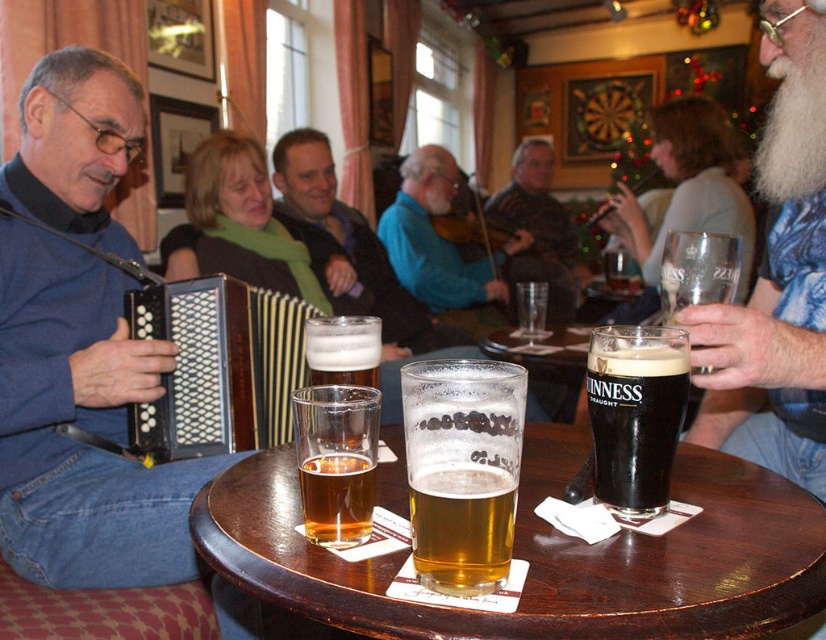
Question: Which of these objects is positioned farthest from the striped sweater at center?

Choices:
 (A) clear glass at center
 (B) blue fabric sweater at left

Answer: (B)

Question: Which point is farther to the camera?

Choices:
 (A) (458, 400)
 (B) (516, 477)
 (C) (339, 378)
 (D) (383, 228)

Answer: (D)

Question: From the image, what is the correct spatial relationship of black glass at table center in relation to blue striped sweater at center?

Choices:
 (A) above
 (B) below

Answer: (B)

Question: Is blue fabric sweater at left in front of gray-blue shirt at center?

Choices:
 (A) no
 (B) yes

Answer: (A)

Question: Estimate the real-world distances between objects in this image. Which object is closer to the blue striped sweater at center?

Choices:
 (A) guinness glass at right
 (B) black plastic accordion at left

Answer: (B)

Question: Does black plastic accordion at left appear on the left side of clear glass at center?

Choices:
 (A) yes
 (B) no

Answer: (A)